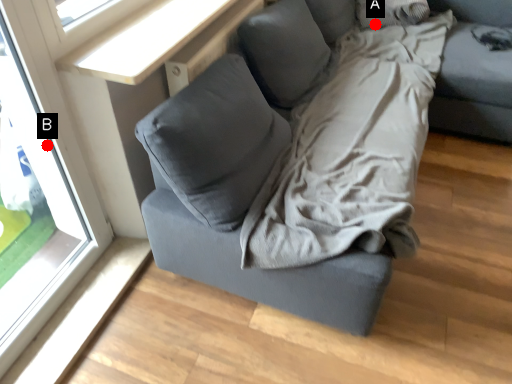
Question: Two points are circled on the image, labeled by A and B beside each circle. Which point is farther to the camera?

Choices:
 (A) A is further
 (B) B is further

Answer: (A)